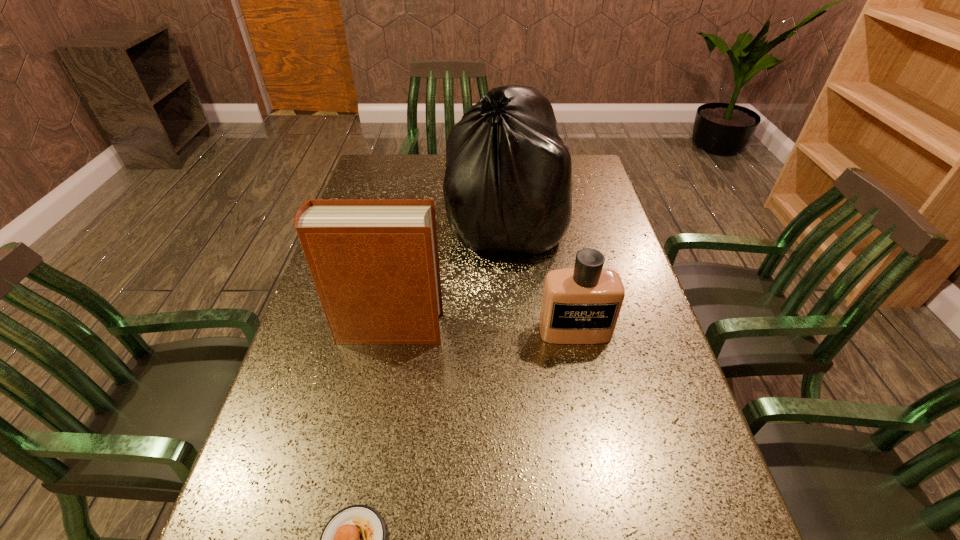
This screenshot has height=540, width=960. Identify the location of perfume that is at the right edge. (581, 305).

Locate an element on the screen. This screenshot has width=960, height=540. object that is positioned at the far right corner is located at coordinates (508, 185).

You are a GUI agent. You are given a task and a screenshot of the screen. Output one action in this format:
    pyautogui.click(x=<x>, y=<y>)
    Task: Click on the blank area at the left edge
    
    Given the screenshot: What is the action you would take?
    pyautogui.click(x=298, y=435)

Find the location of a particular element. The width and height of the screenshot is (960, 540). vacant space at the right edge of the desktop is located at coordinates (602, 196).

Where is `vacant space in between the farthest object and the third tallest object`? This screenshot has width=960, height=540. vacant space in between the farthest object and the third tallest object is located at coordinates (541, 276).

Find the location of `empty location between the perfume and the hardback book`. empty location between the perfume and the hardback book is located at coordinates (482, 330).

Identify the location of vacant area that lies between the hardback book and the third tallest object. (482, 330).

Choose which object is the second nearest neighbor to the perfume. Please provide its 2D coordinates. Your answer should be formatted as a tuple, i.e. [(x, y)], where the tuple contains the x and y coordinates of a point satisfying the conditions above.

[(375, 264)]

Select which object appears as the closest to the food. Please provide its 2D coordinates. Your answer should be formatted as a tuple, i.e. [(x, y)], where the tuple contains the x and y coordinates of a point satisfying the conditions above.

[(375, 264)]